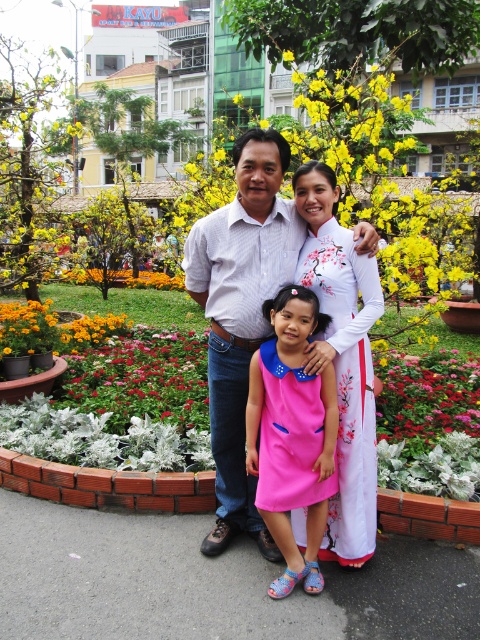
Looking at this image, who is shorter, white striped shirt at center or pink fabric flower at center?

pink fabric flower at center

Who is more forward, (206, 273) or (431, 381)?

Point (206, 273)

The width and height of the screenshot is (480, 640). What are the coordinates of `white striped shirt at center` in the screenshot? It's located at (240, 312).

Between white satin ao dai at center and yellow fabric flower bed at center, which one appears on the left side from the viewer's perspective?

From the viewer's perspective, white satin ao dai at center appears more on the left side.

Which is in front, point (346, 428) or point (477, 321)?

Point (346, 428) is in front.

Where is `white satin ao dai at center`? The image size is (480, 640). white satin ao dai at center is located at coordinates (343, 358).

Does multicolored fabric at center lie in front of wooden bench at lower center?

No.

Between point (132, 397) and point (436, 512), which one is positioned in front?

Positioned in front is point (436, 512).

Image resolution: width=480 pixels, height=640 pixels. I want to click on multicolored fabric at center, so click(141, 378).